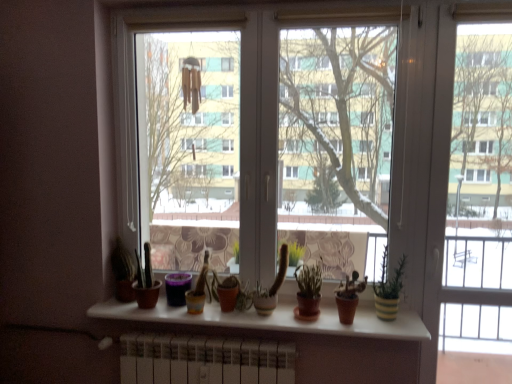
Question: Considering the positions of yellow striped pot at right and matte brown pot at center in the image, is yellow striped pot at right taller or shorter than matte brown pot at center?

Choices:
 (A) short
 (B) tall

Answer: (B)

Question: From the image's perspective, relative to matte brown pot at center, is yellow striped pot at right above or below?

Choices:
 (A) above
 (B) below

Answer: (A)

Question: Which of these objects is positioned closest to the white matte window sill at center?

Choices:
 (A) yellow striped pot at right
 (B) matte brown pot at center
 (C) green matte plant at center
 (D) transparent glass window at center
 (E) transparent glass screen door at center

Answer: (A)

Question: Which object is the farthest from the matte brown pot at center?

Choices:
 (A) transparent glass window at center
 (B) yellow striped pot at right
 (C) white matte window sill at center
 (D) transparent glass screen door at center
 (E) green matte plant at center

Answer: (D)